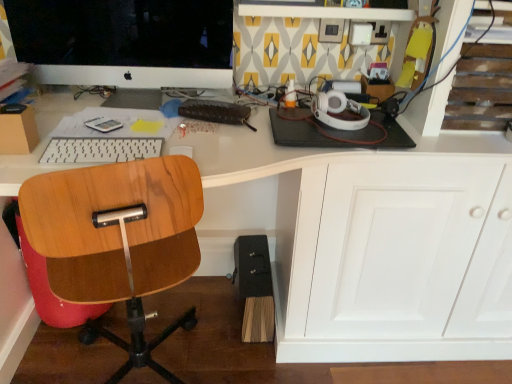
Question: Would you say white glossy desk at center is a long distance from wooden chair at left?

Choices:
 (A) yes
 (B) no

Answer: (B)

Question: From a real-world perspective, is white glossy desk at center on wooden chair at left?

Choices:
 (A) yes
 (B) no

Answer: (A)

Question: Considering the relative positions of white glossy desk at center and wooden chair at left in the image provided, is white glossy desk at center to the left of wooden chair at left from the viewer's perspective?

Choices:
 (A) no
 (B) yes

Answer: (A)

Question: Is white glossy desk at center next to wooden chair at left and touching it?

Choices:
 (A) yes
 (B) no

Answer: (B)

Question: From the image's perspective, is white glossy desk at center under wooden chair at left?

Choices:
 (A) no
 (B) yes

Answer: (A)

Question: Is point (80, 142) positioned closer to the camera than point (24, 38)?

Choices:
 (A) farther
 (B) closer

Answer: (B)

Question: Is white plastic keyboard at center situated inside matte black monitor at upper left or outside?

Choices:
 (A) outside
 (B) inside

Answer: (A)

Question: Is white plastic keyboard at center wider or thinner than matte black monitor at upper left?

Choices:
 (A) wide
 (B) thin

Answer: (B)

Question: Is white plastic keyboard at center taller or shorter than matte black monitor at upper left?

Choices:
 (A) tall
 (B) short

Answer: (B)

Question: Is white glossy desk at center to the left or to the right of matte black monitor at upper left in the image?

Choices:
 (A) right
 (B) left

Answer: (A)

Question: Looking at their shapes, would you say white glossy desk at center is wider or thinner than matte black monitor at upper left?

Choices:
 (A) thin
 (B) wide

Answer: (B)

Question: Is white glossy desk at center in front of or behind matte black monitor at upper left in the image?

Choices:
 (A) behind
 (B) front

Answer: (B)

Question: Does point (285, 196) appear closer or farther from the camera than point (115, 28)?

Choices:
 (A) farther
 (B) closer

Answer: (A)

Question: From a real-world perspective, is matte black monitor at upper left physically located above or below wooden chair at left?

Choices:
 (A) above
 (B) below

Answer: (A)

Question: Is matte black monitor at upper left to the left or to the right of wooden chair at left in the image?

Choices:
 (A) left
 (B) right

Answer: (A)